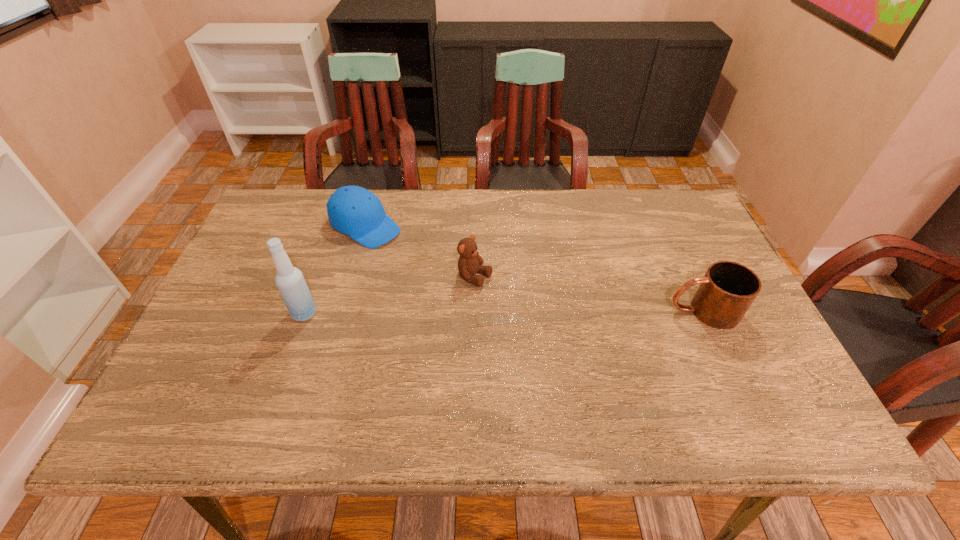
The image size is (960, 540). Identify the location of free space at the far left corner of the desktop. (280, 225).

In the image, there is a desktop. Identify the location of vacant space at the near right corner. (770, 386).

Where is `empty location between the bottle and the second object from right to left`? empty location between the bottle and the second object from right to left is located at coordinates (390, 295).

Image resolution: width=960 pixels, height=540 pixels. Find the location of `free space between the tallest object and the farthest object`. free space between the tallest object and the farthest object is located at coordinates (335, 269).

Locate an element on the screen. vacant space that is in between the tallest object and the mug is located at coordinates (503, 312).

Identify the location of empty space between the teddy bear and the rightmost object. Image resolution: width=960 pixels, height=540 pixels. (589, 294).

Locate an element on the screen. empty space between the tallest object and the rightmost object is located at coordinates (503, 312).

In order to click on free space between the farthest object and the second farthest object in this screenshot , I will do `click(420, 252)`.

At what (x,y) coordinates should I click in order to perform the action: click on vacant area between the second farthest object and the farthest object. Please return your answer as a coordinate pair (x, y). Image resolution: width=960 pixels, height=540 pixels. Looking at the image, I should click on [x=420, y=252].

In order to click on unoccupied position between the bottle and the mug in this screenshot , I will do `click(503, 312)`.